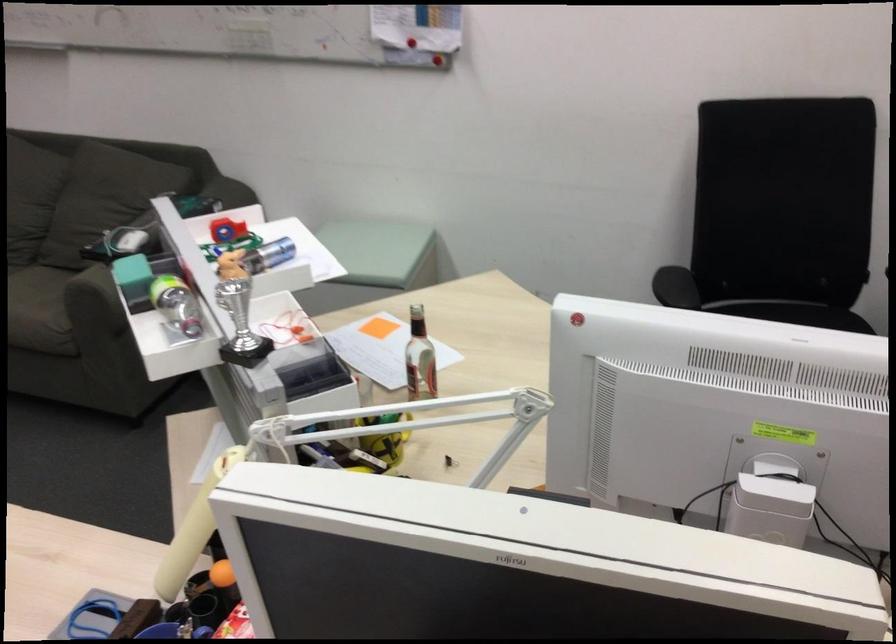
What do you see at coordinates (437, 410) in the screenshot? The height and width of the screenshot is (644, 896). I see `the white lamp arm` at bounding box center [437, 410].